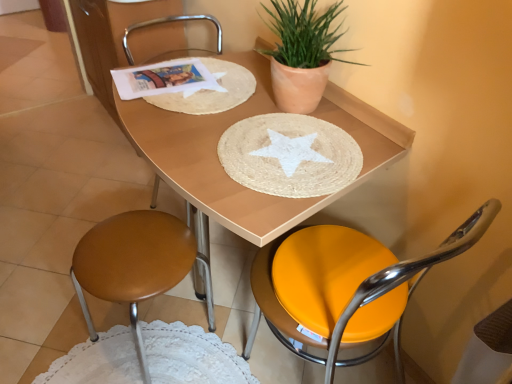
Question: Is wooden placemat at center at the left side of orange leather chair at center, the first chair positioned from the right?

Choices:
 (A) yes
 (B) no

Answer: (A)

Question: Considering the relative sizes of wooden placemat at center and orange leather chair at center, placed as the third chair when sorted from left to right, in the image provided, is wooden placemat at center thinner than orange leather chair at center, placed as the third chair when sorted from left to right,?

Choices:
 (A) no
 (B) yes

Answer: (A)

Question: Considering the relative sizes of wooden placemat at center and orange leather chair at center, the first chair positioned from the right, in the image provided, is wooden placemat at center taller than orange leather chair at center, the first chair positioned from the right,?

Choices:
 (A) yes
 (B) no

Answer: (B)

Question: Is wooden placemat at center to the right of orange leather chair at center, placed as the third chair when sorted from left to right, from the viewer's perspective?

Choices:
 (A) yes
 (B) no

Answer: (B)

Question: Is wooden placemat at center next to orange leather chair at center, the first chair positioned from the right?

Choices:
 (A) yes
 (B) no

Answer: (B)

Question: Considering the positions of point (309, 8) and point (113, 238), is point (309, 8) closer or farther from the camera than point (113, 238)?

Choices:
 (A) farther
 (B) closer

Answer: (B)

Question: From the image's perspective, is terracotta clay pot at upper right located above or below wooden seat at lower left, the 3th chair in the right-to-left sequence?

Choices:
 (A) above
 (B) below

Answer: (A)

Question: Is terracotta clay pot at upper right bigger or smaller than wooden seat at lower left, the first chair positioned from the left?

Choices:
 (A) small
 (B) big

Answer: (A)

Question: Considering their positions, is terracotta clay pot at upper right located in front of or behind wooden seat at lower left, the first chair positioned from the left?

Choices:
 (A) front
 (B) behind

Answer: (A)

Question: In terms of height, does white paper at upper left look taller or shorter compared to natural fiber placemat at center, the first paper plate positioned from the bottom?

Choices:
 (A) short
 (B) tall

Answer: (A)

Question: Looking at the image, does white paper at upper left seem bigger or smaller compared to natural fiber placemat at center, the first paper plate positioned from the bottom?

Choices:
 (A) small
 (B) big

Answer: (A)

Question: Considering the relative positions of white paper at upper left and natural fiber placemat at center, the 2th paper plate when ordered from top to bottom, in the image provided, is white paper at upper left to the left or to the right of natural fiber placemat at center, the 2th paper plate when ordered from top to bottom,?

Choices:
 (A) left
 (B) right

Answer: (A)

Question: From the image's perspective, relative to natural fiber placemat at center, the 2th paper plate when ordered from top to bottom, is white paper at upper left above or below?

Choices:
 (A) below
 (B) above

Answer: (B)

Question: From the image's perspective, relative to terracotta clay pot at upper right, is metallic silver chair at center, the second chair in the right-to-left sequence, above or below?

Choices:
 (A) above
 (B) below

Answer: (B)

Question: In terms of size, does metallic silver chair at center, the second chair in the right-to-left sequence, appear bigger or smaller than terracotta clay pot at upper right?

Choices:
 (A) small
 (B) big

Answer: (B)